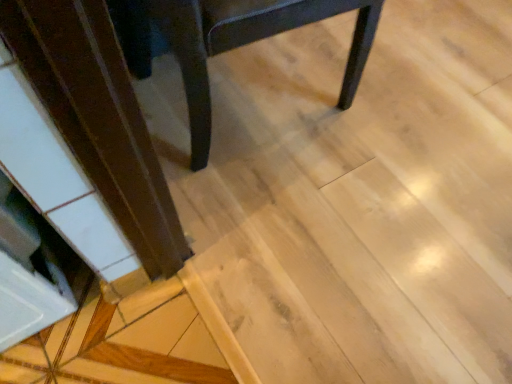
Question: Considering the positions of light brown wood at lower left and matte black chair at center in the image, is light brown wood at lower left taller or shorter than matte black chair at center?

Choices:
 (A) tall
 (B) short

Answer: (B)

Question: Is point (35, 3) closer or farther from the camera than point (337, 4)?

Choices:
 (A) farther
 (B) closer

Answer: (B)

Question: Is light brown wood at lower left to the left or to the right of matte black chair at center in the image?

Choices:
 (A) right
 (B) left

Answer: (B)

Question: In terms of height, does matte black chair at center look taller or shorter compared to light brown wood at lower left?

Choices:
 (A) tall
 (B) short

Answer: (A)

Question: Considering their positions, is matte black chair at center located in front of or behind light brown wood at lower left?

Choices:
 (A) front
 (B) behind

Answer: (A)

Question: From the image's perspective, is matte black chair at center positioned above or below light brown wood at lower left?

Choices:
 (A) above
 (B) below

Answer: (A)

Question: Considering the positions of point (158, 26) and point (36, 82), is point (158, 26) closer or farther from the camera than point (36, 82)?

Choices:
 (A) closer
 (B) farther

Answer: (B)